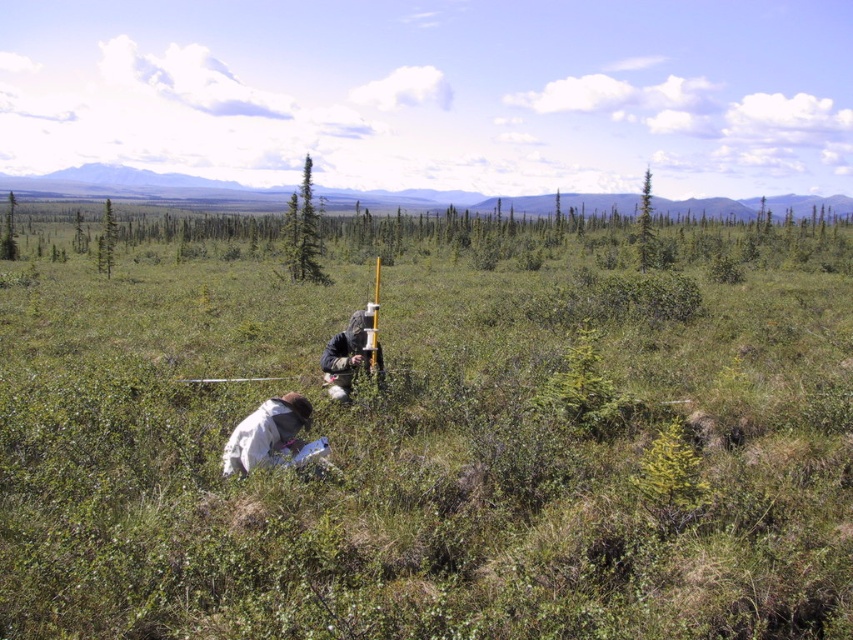
You are a hiker planning to take a photo of both the green textured tree at upper right and the green coniferous tree at upper left. Which tree should you stand closer to in order to capture both in the same frame?

You should stand closer to the green coniferous tree at upper left since it is shorter than the green textured tree at upper right, allowing both to be included in the frame when positioned appropriately.

From the picture: You are a hiker who has just arrived at the scene. You notice the white fabric at center and the green coniferous tree at upper left. Which object is closer to you?

The white fabric at center is closer to you because it is positioned under the green coniferous tree at upper left, which places it in a lower, more accessible position within the scene.

You are a hiker trying to navigate through the dense vegetation in the foreground. You see the white fabric at center and the green coniferous tree at upper left. Which object is located to the right of the other?

The white fabric at center is positioned on the right side of green coniferous tree at upper left.